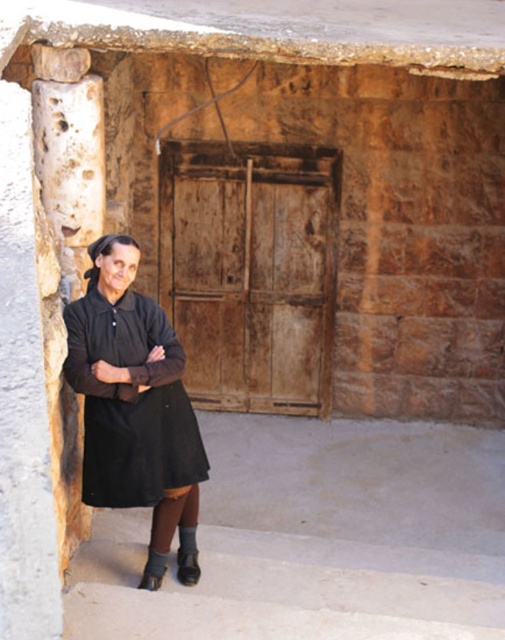
Question: Which of the following is the farthest from the observer?

Choices:
 (A) (185, 576)
 (B) (98, 388)
 (C) (227, 356)

Answer: (C)

Question: Is rusty wood door at center thinner than matte black dress at center?

Choices:
 (A) yes
 (B) no

Answer: (B)

Question: Observing the image, what is the correct spatial positioning of matte black dress at center in reference to black suede boot at lower left?

Choices:
 (A) below
 (B) above

Answer: (B)

Question: Based on their relative distances, which object is nearer to the black suede boot at lower left?

Choices:
 (A) black leather boot at lower center
 (B) matte black dress at center

Answer: (A)

Question: Which point is closer to the camera?

Choices:
 (A) black suede boot at lower left
 (B) matte black dress at center
 (C) rusty wood door at center
 (D) black leather boot at lower center

Answer: (B)

Question: Does black leather boot at lower center appear under black suede boot at lower left?

Choices:
 (A) yes
 (B) no

Answer: (B)